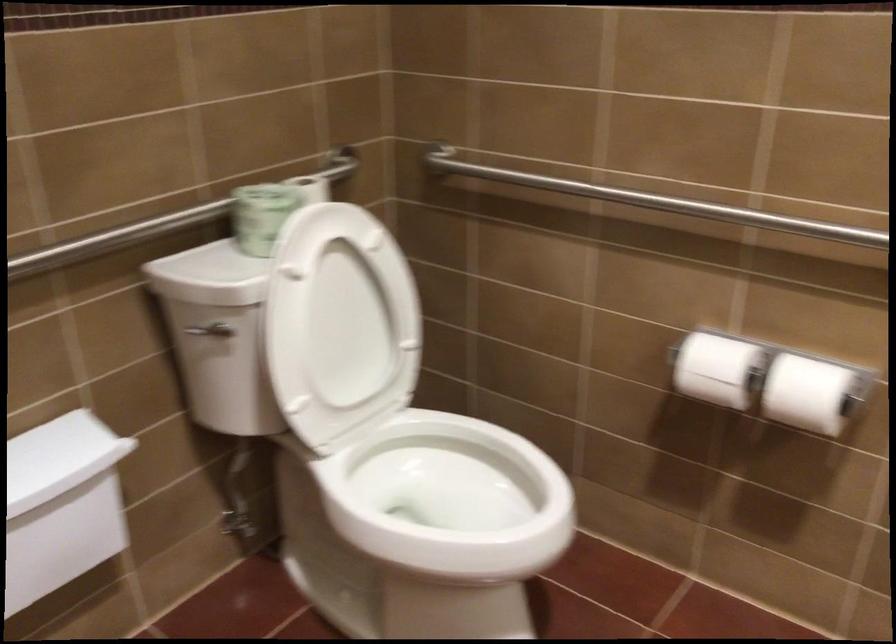
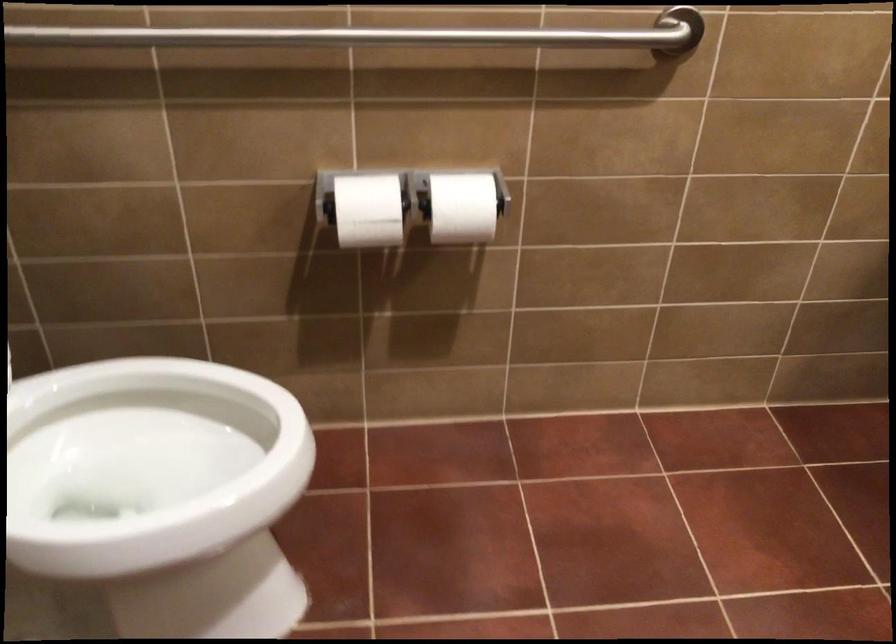
Where in the second image is the point corresponding to (x=771, y=214) from the first image?

(378, 35)